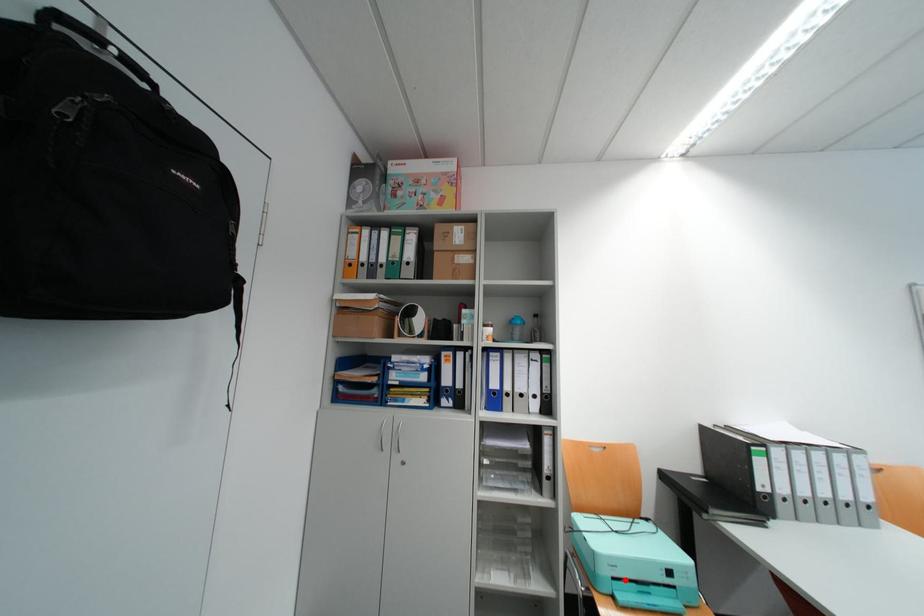
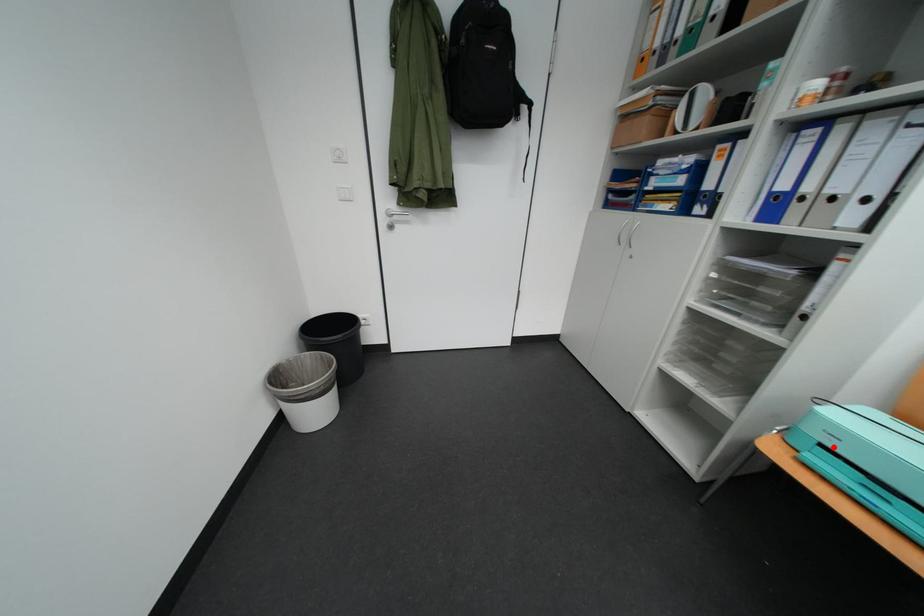
In the scene shown: I am providing you with two images of the same scene from different viewpoints. A red point is marked on the first image and another point is marked on the second image. Is the marked point in image1 the same physical position as the marked point in image2?

Yes